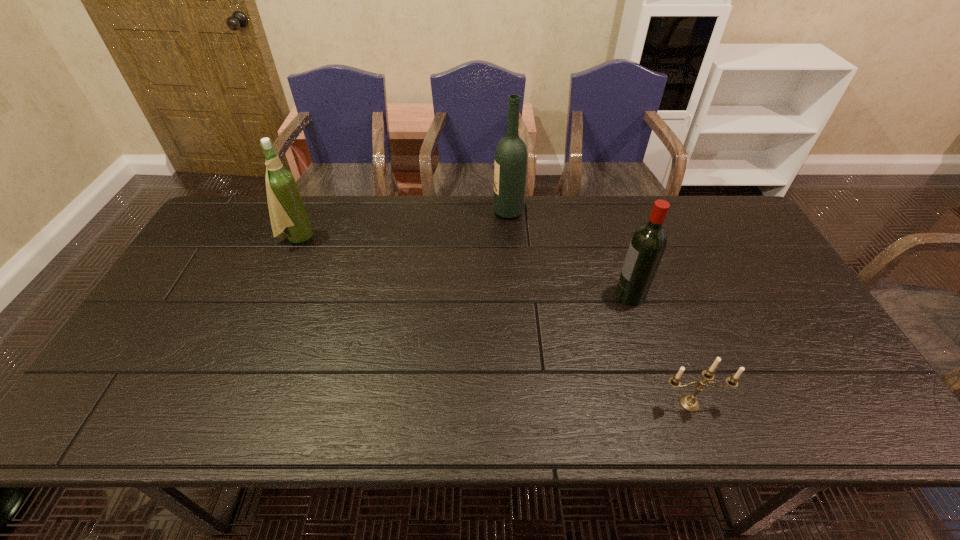
I want to click on blank area located on the labeled side of the farthest object, so click(x=457, y=212).

You are a GUI agent. You are given a task and a screenshot of the screen. Output one action in this format:
    pyautogui.click(x=<x>, y=<y>)
    Task: Click on the free space located on the front-facing side of the leftmost object
    Image resolution: width=960 pixels, height=540 pixels.
    Given the screenshot: What is the action you would take?
    pyautogui.click(x=372, y=239)

Image resolution: width=960 pixels, height=540 pixels. I want to click on free space located on the label of the rightmost wine bottle, so click(x=474, y=295).

The width and height of the screenshot is (960, 540). I want to click on vacant region located on the label of the rightmost wine bottle, so click(x=485, y=295).

At what (x,y) coordinates should I click in order to perform the action: click on vacant space situated 0.360m on the label of the rightmost wine bottle. Please return your answer as a coordinate pair (x, y). This screenshot has height=540, width=960. Looking at the image, I should click on (485, 295).

Find the location of a particular element. vacant region located 0.220m on the back of the nearest object is located at coordinates (660, 319).

Identify the location of object situated at the near edge. The height and width of the screenshot is (540, 960). (688, 402).

Identify the location of free space at the far edge of the desktop. The width and height of the screenshot is (960, 540). (548, 221).

In the image, there is a desktop. What are the coordinates of `free region at the near edge` in the screenshot? It's located at (543, 423).

The image size is (960, 540). In the image, there is a desktop. In order to click on vacant space at the left edge in this screenshot , I will do `click(149, 341)`.